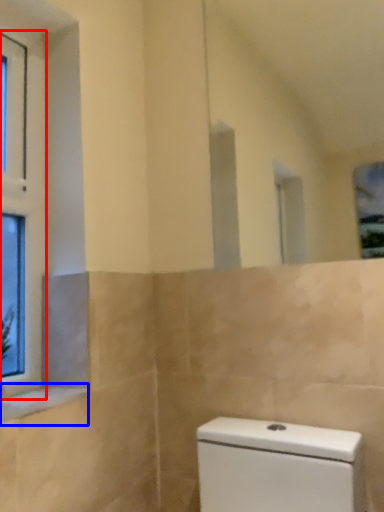
Question: Which object appears farthest to the camera in this image, window (highlighted by a red box) or window sill (highlighted by a blue box)?

Choices:
 (A) window
 (B) window sill

Answer: (A)